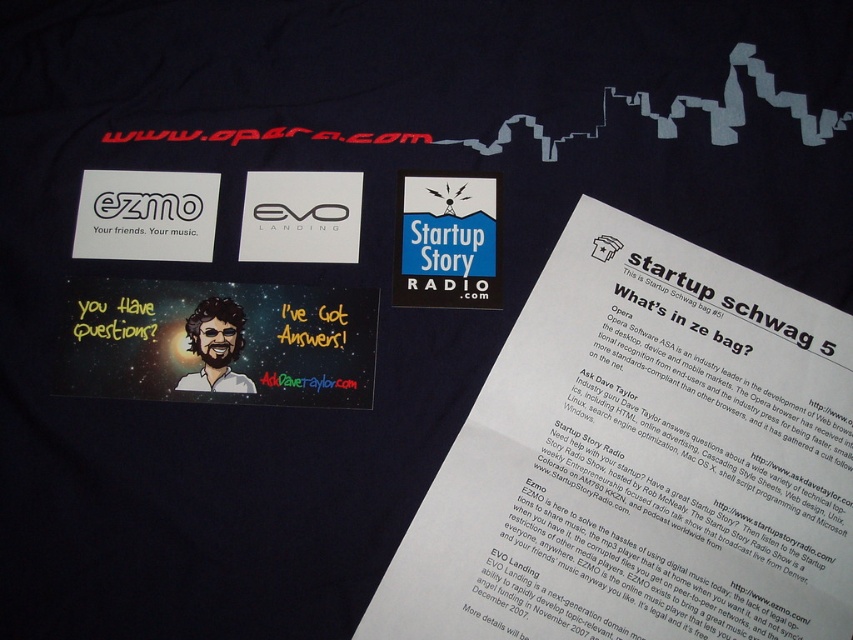
From the picture: Which of these two, blue paper at center or cartoon character sticker at center, stands shorter?

Standing shorter between the two is cartoon character sticker at center.

Who is positioned more to the left, blue paper at center or cartoon character sticker at center?

cartoon character sticker at center is more to the left.

Does point (544, 570) lie in front of point (206, 385)?

Yes, it is.

This screenshot has height=640, width=853. I want to click on blue paper at center, so pos(641,460).

Which is more to the left, blue paper sticker at center or cartoon character sticker at center?

cartoon character sticker at center is more to the left.

Is blue paper sticker at center shorter than cartoon character sticker at center?

No.

This screenshot has width=853, height=640. In order to click on blue paper sticker at center in this screenshot , I will do `click(445, 241)`.

Is point (659, 259) closer to viewer compared to point (421, 285)?

Yes.

Who is more distant from viewer, (535,486) or (469,200)?

The point (469,200) is behind.

Who is more forward, (627, 372) or (405, 177)?

Point (627, 372)

What are the coordinates of `blue paper at center` in the screenshot? It's located at (641, 460).